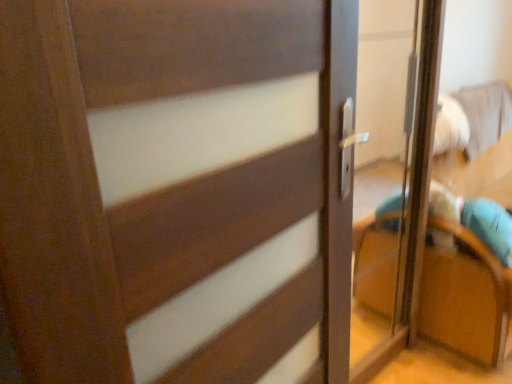
Question: In terms of height, does teal fabric armchair at right look taller or shorter compared to matte wood door at center?

Choices:
 (A) short
 (B) tall

Answer: (A)

Question: Is teal fabric armchair at right situated inside matte wood door at center or outside?

Choices:
 (A) outside
 (B) inside

Answer: (A)

Question: In the image, is teal fabric armchair at right on the left side or the right side of matte wood door at center?

Choices:
 (A) left
 (B) right

Answer: (B)

Question: Does point (154, 221) appear closer or farther from the camera than point (460, 324)?

Choices:
 (A) closer
 (B) farther

Answer: (A)

Question: Based on their sizes in the image, would you say matte wood door at center is bigger or smaller than teal fabric armchair at right?

Choices:
 (A) big
 (B) small

Answer: (B)

Question: Relative to teal fabric armchair at right, is matte wood door at center in front or behind?

Choices:
 (A) behind
 (B) front

Answer: (B)

Question: From the image's perspective, is matte wood door at center positioned above or below teal fabric armchair at right?

Choices:
 (A) below
 (B) above

Answer: (A)